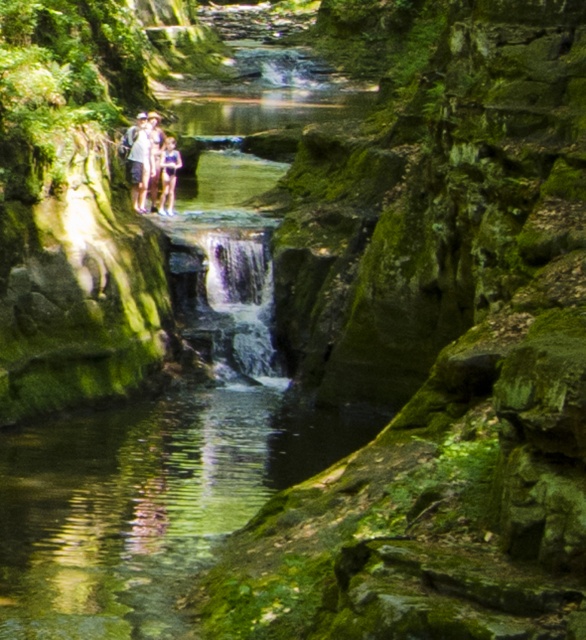
Does light brown wooden couple at center have a smaller size compared to blue denim shorts at center?

Incorrect, light brown wooden couple at center is not smaller in size than blue denim shorts at center.

Does light brown wooden couple at center have a greater height compared to blue denim shorts at center?

Indeed, light brown wooden couple at center has a greater height compared to blue denim shorts at center.

In order to click on light brown wooden couple at center in this screenshot , I will do `click(142, 157)`.